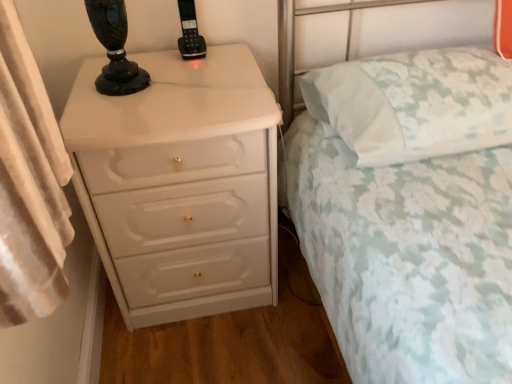
This screenshot has width=512, height=384. I want to click on white glossy chest of drawers at left, so click(x=180, y=183).

Describe the element at coordinates (190, 32) in the screenshot. I see `black plastic phone at upper center` at that location.

Locate an element on the screen. Image resolution: width=512 pixels, height=384 pixels. black plastic phone at upper center is located at coordinates (190, 32).

Where is `white glossy chest of drawers at left`? This screenshot has width=512, height=384. white glossy chest of drawers at left is located at coordinates (180, 183).

From the image's perspective, who appears lower, white floral fabric bed at center or black plastic phone at upper center?

From the image's view, white floral fabric bed at center is below.

From the picture: From a real-world perspective, is white floral fabric bed at center located higher than black plastic phone at upper center?

No, from a real-world perspective, white floral fabric bed at center is not on top of black plastic phone at upper center.

Is white floral fabric bed at center positioned far away from black plastic phone at upper center?

Actually, white floral fabric bed at center and black plastic phone at upper center are a little close together.

Consider the image. Could you tell me if white floral fabric bed at center is facing black plastic phone at upper center?

No.

Can you confirm if white floral fabric pillow at upper right is positioned to the right of black plastic phone at upper center?

Indeed, white floral fabric pillow at upper right is positioned on the right side of black plastic phone at upper center.

Is white floral fabric pillow at upper right situated inside black plastic phone at upper center or outside?

white floral fabric pillow at upper right exists outside the volume of black plastic phone at upper center.

From a real-world perspective, is white floral fabric pillow at upper right on top of black plastic phone at upper center?

Incorrect, from a real-world perspective, white floral fabric pillow at upper right is lower than black plastic phone at upper center.

Is white floral fabric pillow at upper right next to black plastic phone at upper center?

No, white floral fabric pillow at upper right is not next to black plastic phone at upper center.

Does white glossy chest of drawers at left turn towards white floral fabric bed at center?

No, white glossy chest of drawers at left is not facing towards white floral fabric bed at center.

Consider the image. From a real-world perspective, who is located lower, white glossy chest of drawers at left or white floral fabric bed at center?

In real-world perspective, white glossy chest of drawers at left is lower.

Measure the distance from white glossy chest of drawers at left to white floral fabric bed at center.

white glossy chest of drawers at left and white floral fabric bed at center are 15.20 inches apart from each other.

Between white glossy chest of drawers at left and white floral fabric bed at center, which one has larger size?

Bigger between the two is white floral fabric bed at center.

Does point (195, 24) lie in front of point (478, 131)?

No, it is behind (478, 131).

Considering the positions of objects black plastic phone at upper center and white floral fabric pillow at upper right in the image provided, who is behind, black plastic phone at upper center or white floral fabric pillow at upper right?

black plastic phone at upper center is behind.

Which of these two, black plastic phone at upper center or white floral fabric pillow at upper right, is bigger?

With larger size is white floral fabric pillow at upper right.

Would you say black plastic phone at upper center is to the left or to the right of white floral fabric pillow at upper right in the picture?

Based on their positions, black plastic phone at upper center is located to the left of white floral fabric pillow at upper right.

From a real-world perspective, who is located higher, white glossy chest of drawers at left or black plastic phone at upper center?

black plastic phone at upper center, from a real-world perspective.

Is white glossy chest of drawers at left to the left or to the right of black plastic phone at upper center in the image?

white glossy chest of drawers at left is positioned on black plastic phone at upper center's left side.

Looking at this image, which of these two, white glossy chest of drawers at left or black plastic phone at upper center, is bigger?

white glossy chest of drawers at left.

From the image's perspective, is white glossy chest of drawers at left positioned above or below black plastic phone at upper center?

white glossy chest of drawers at left is situated lower than black plastic phone at upper center in the image.

How distant is black plastic phone at upper center from white glossy chest of drawers at left?

black plastic phone at upper center is 43.20 centimeters from white glossy chest of drawers at left.

Looking at their sizes, would you say black plastic phone at upper center is wider or thinner than white glossy chest of drawers at left?

Clearly, black plastic phone at upper center has less width compared to white glossy chest of drawers at left.

Can you confirm if black plastic phone at upper center is smaller than white glossy chest of drawers at left?

Yes.

From a real-world perspective, is black plastic phone at upper center on top of white glossy chest of drawers at left?

Indeed, from a real-world perspective, black plastic phone at upper center stands above white glossy chest of drawers at left.

From a real-world perspective, between white floral fabric bed at center and white glossy chest of drawers at left, who is vertically higher?

In real-world perspective, white floral fabric bed at center is above.

Is the surface of white floral fabric bed at center in direct contact with white glossy chest of drawers at left?

There is a gap between white floral fabric bed at center and white glossy chest of drawers at left.

Between white floral fabric bed at center and white glossy chest of drawers at left, which one has less height?

Standing shorter between the two is white glossy chest of drawers at left.

Considering the relative sizes of white floral fabric bed at center and white glossy chest of drawers at left in the image provided, is white floral fabric bed at center bigger than white glossy chest of drawers at left?

Correct, white floral fabric bed at center is larger in size than white glossy chest of drawers at left.

The width and height of the screenshot is (512, 384). Identify the location of control above the white floral fabric bed at center (from the image's perspective). (190, 32).

I want to click on pillow that appears below the black plastic phone at upper center (from a real-world perspective), so tap(415, 103).

Considering their positions, is white glossy chest of drawers at left positioned closer to white floral fabric bed at center than white floral fabric pillow at upper right?

The object closer to white floral fabric bed at center is white floral fabric pillow at upper right.

From the image, which object appears to be farther from white floral fabric pillow at upper right, black plastic phone at upper center or white floral fabric bed at center?

Among the two, black plastic phone at upper center is located further to white floral fabric pillow at upper right.

From the image, which object appears to be farther from white floral fabric bed at center, black plastic phone at upper center or white floral fabric pillow at upper right?

Based on the image, black plastic phone at upper center appears to be further to white floral fabric bed at center.

Looking at the image, which one is located closer to white floral fabric pillow at upper right, white glossy chest of drawers at left or black plastic phone at upper center?

white glossy chest of drawers at left is closer to white floral fabric pillow at upper right.

From the image, which object appears to be farther from white glossy chest of drawers at left, white floral fabric pillow at upper right or white floral fabric bed at center?

Based on the image, white floral fabric pillow at upper right appears to be further to white glossy chest of drawers at left.

Looking at the image, which one is located further to black plastic phone at upper center, white floral fabric bed at center or white floral fabric pillow at upper right?

white floral fabric bed at center lies further to black plastic phone at upper center than the other object.

Which object lies further to the anchor point black plastic phone at upper center, white floral fabric pillow at upper right or white floral fabric bed at center?

white floral fabric bed at center.

When comparing their distances from white floral fabric pillow at upper right, does white glossy chest of drawers at left or white floral fabric bed at center seem further?

Based on the image, white glossy chest of drawers at left appears to be further to white floral fabric pillow at upper right.

Where is `chest of drawers between white floral fabric bed at center and black plastic phone at upper center from front to back`? This screenshot has width=512, height=384. chest of drawers between white floral fabric bed at center and black plastic phone at upper center from front to back is located at coordinates (180, 183).

The width and height of the screenshot is (512, 384). In order to click on bed between white glossy chest of drawers at left and white floral fabric pillow at upper right in the horizontal direction in this screenshot , I will do `click(406, 256)`.

The image size is (512, 384). Find the location of `control between white glossy chest of drawers at left and white floral fabric pillow at upper right`. control between white glossy chest of drawers at left and white floral fabric pillow at upper right is located at coordinates (190, 32).

Identify the location of pillow positioned between white floral fabric bed at center and black plastic phone at upper center from near to far. Image resolution: width=512 pixels, height=384 pixels. (415, 103).